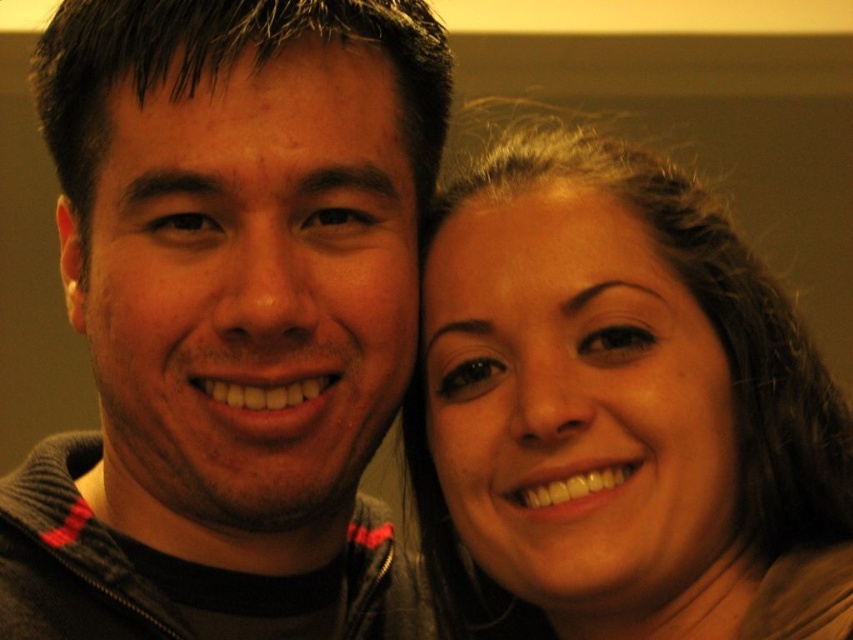
Which is more to the left, matte black jacket at left or matte brown hair at right?

Positioned to the left is matte black jacket at left.

Is matte black jacket at left further to the viewer compared to matte brown hair at right?

That is True.

Is point (67, 445) positioned after point (653, 246)?

Yes.

Find the location of a particular element. The image size is (853, 640). matte black jacket at left is located at coordinates (228, 317).